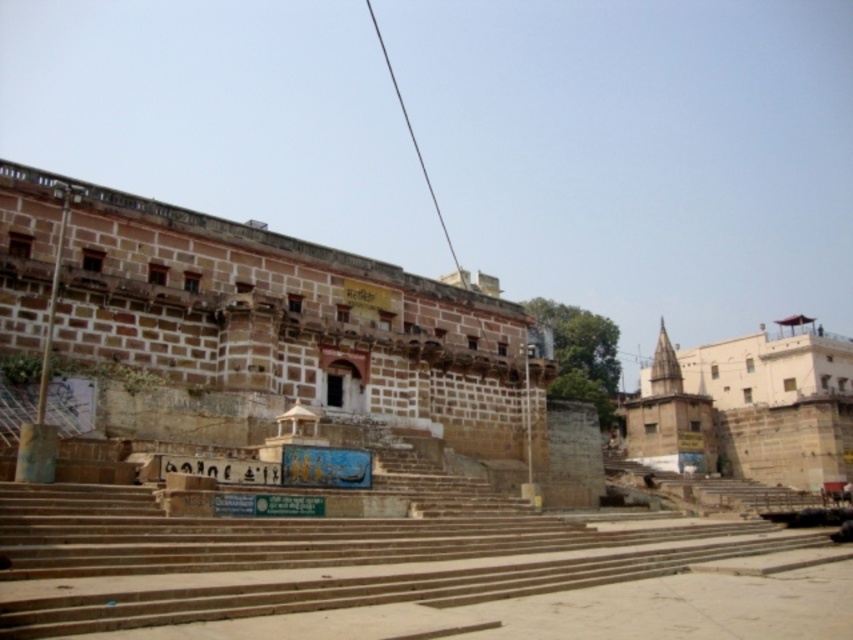
Question: Is brown stone stairs at center wider than beige stone temple at right?

Choices:
 (A) yes
 (B) no

Answer: (A)

Question: Which is nearer to the brown stone stairs at center?

Choices:
 (A) brown stone palace at center
 (B) beige stone temple at right

Answer: (A)

Question: Is brown stone stairs at center to the left of brown stone palace at center from the viewer's perspective?

Choices:
 (A) no
 (B) yes

Answer: (A)

Question: Which point is farther to the camera?

Choices:
 (A) beige stone temple at right
 (B) brown stone palace at center
 (C) brown stone stairs at center

Answer: (A)

Question: Does brown stone stairs at center appear over brown stone palace at center?

Choices:
 (A) yes
 (B) no

Answer: (B)

Question: Among these points, which one is nearest to the camera?

Choices:
 (A) (471, 368)
 (B) (59, 588)
 (C) (633, 436)

Answer: (B)